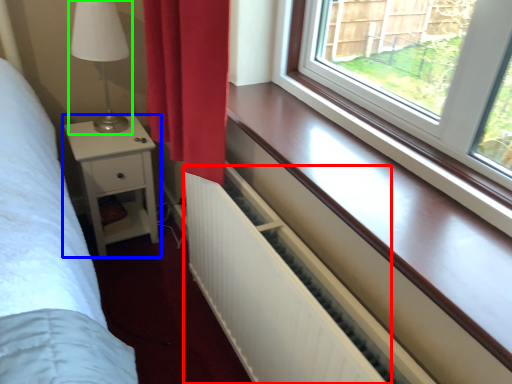
Question: Which object is positioned farthest from radiator (highlighted by a red box)? Select from nightstand (highlighted by a blue box) and table lamp (highlighted by a green box).

Choices:
 (A) nightstand
 (B) table lamp

Answer: (B)